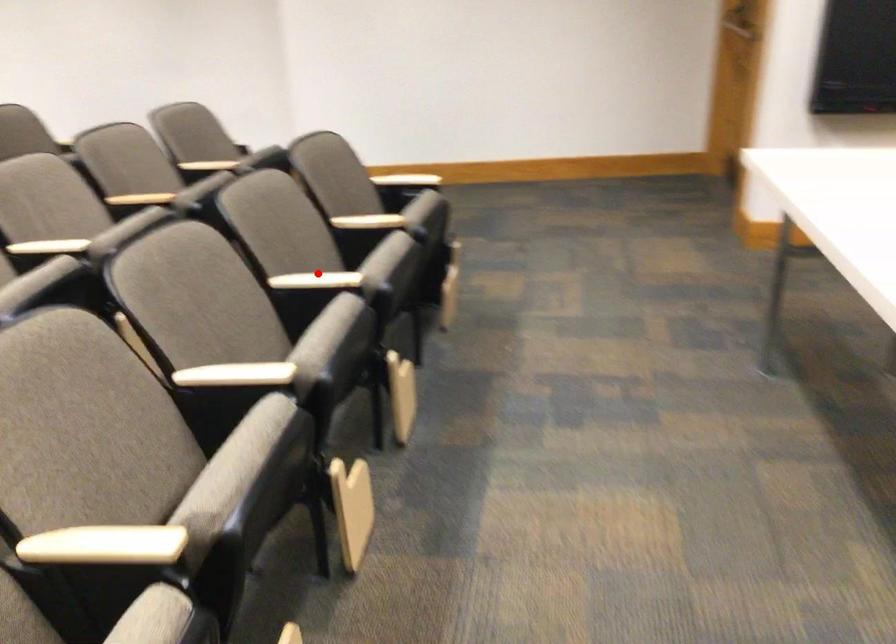
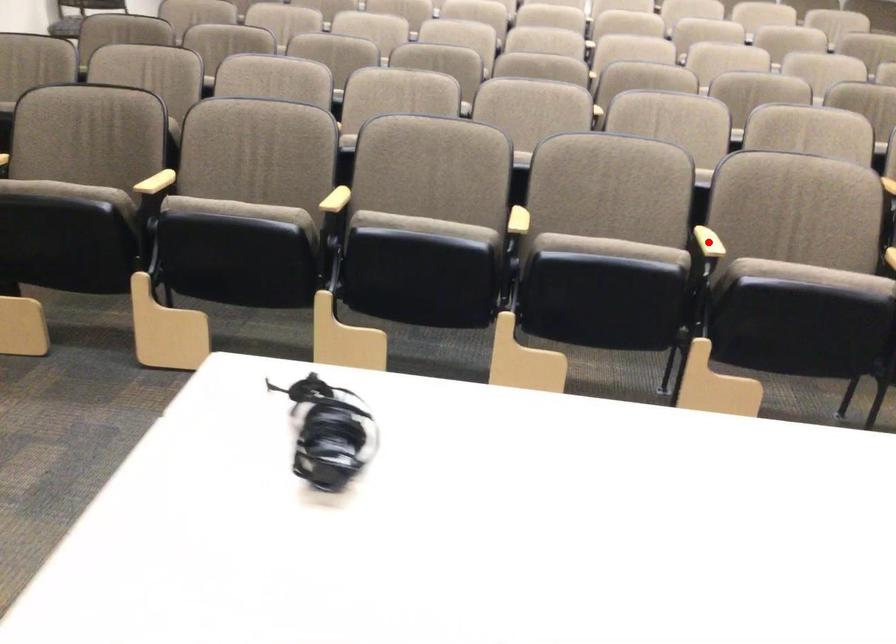
I am providing you with two images of the same scene from different viewpoints. A red point is marked on the first image and another point is marked on the second image. Are the points marked in image1 and image2 representing the same 3D position?

Yes